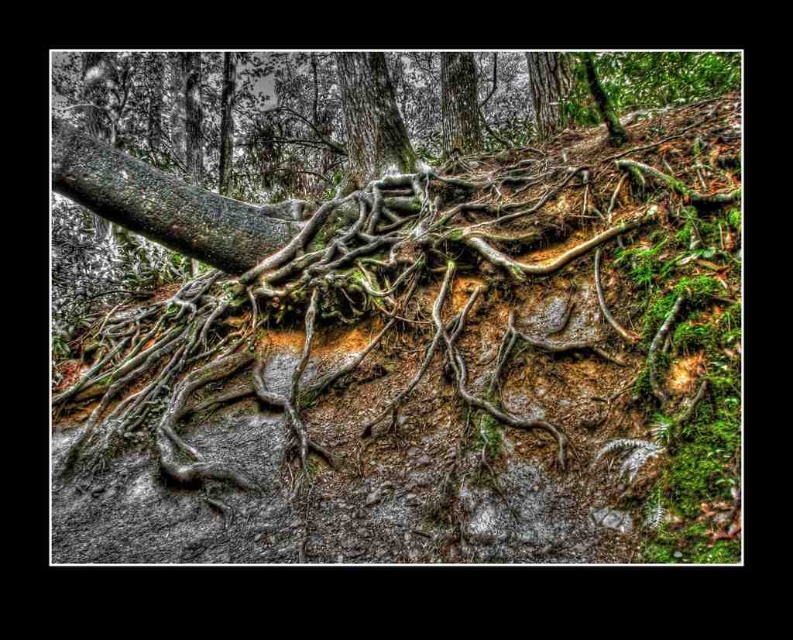
Question: Does brown rough roots at center appear over smooth gray bark at center?

Choices:
 (A) yes
 (B) no

Answer: (B)

Question: Can you confirm if brown rough roots at center is positioned below smooth gray bark at center?

Choices:
 (A) yes
 (B) no

Answer: (A)

Question: Which point is closer to the camera?

Choices:
 (A) (86, 451)
 (B) (209, 218)

Answer: (A)

Question: Is brown rough roots at center wider than smooth gray bark at center?

Choices:
 (A) yes
 (B) no

Answer: (A)